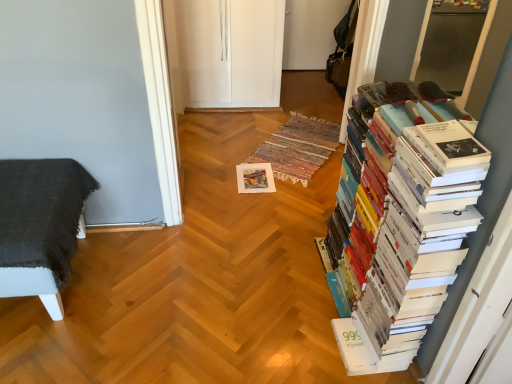
Question: From a real-world perspective, is dark gray woven blanket on the left on top of white paper book at right?

Choices:
 (A) no
 (B) yes

Answer: (A)

Question: Is dark gray woven blanket on the left with white paper book at right?

Choices:
 (A) yes
 (B) no

Answer: (B)

Question: From the image's perspective, is dark gray woven blanket on the left under white paper book at right?

Choices:
 (A) no
 (B) yes

Answer: (B)

Question: Is dark gray woven blanket on the left smaller than white paper book at right?

Choices:
 (A) yes
 (B) no

Answer: (A)

Question: Would you consider dark gray woven blanket on the left to be distant from white paper book at right?

Choices:
 (A) no
 (B) yes

Answer: (B)

Question: Does dark gray woven blanket on the left have a larger size compared to white paper book at right?

Choices:
 (A) yes
 (B) no

Answer: (B)

Question: Is white paper at center smaller than white paper book at right?

Choices:
 (A) yes
 (B) no

Answer: (A)

Question: Can you confirm if white paper at center is shorter than white paper book at right?

Choices:
 (A) yes
 (B) no

Answer: (A)

Question: Could white paper book at right be considered to be inside white paper at center?

Choices:
 (A) no
 (B) yes

Answer: (A)

Question: Is white paper at center touching white paper book at right?

Choices:
 (A) no
 (B) yes

Answer: (A)

Question: Does white paper at center have a larger size compared to white paper book at right?

Choices:
 (A) yes
 (B) no

Answer: (B)

Question: Is white paper at center positioned with its back to white paper book at right?

Choices:
 (A) no
 (B) yes

Answer: (A)

Question: Is white paper book at right smaller than white paper at center?

Choices:
 (A) yes
 (B) no

Answer: (B)